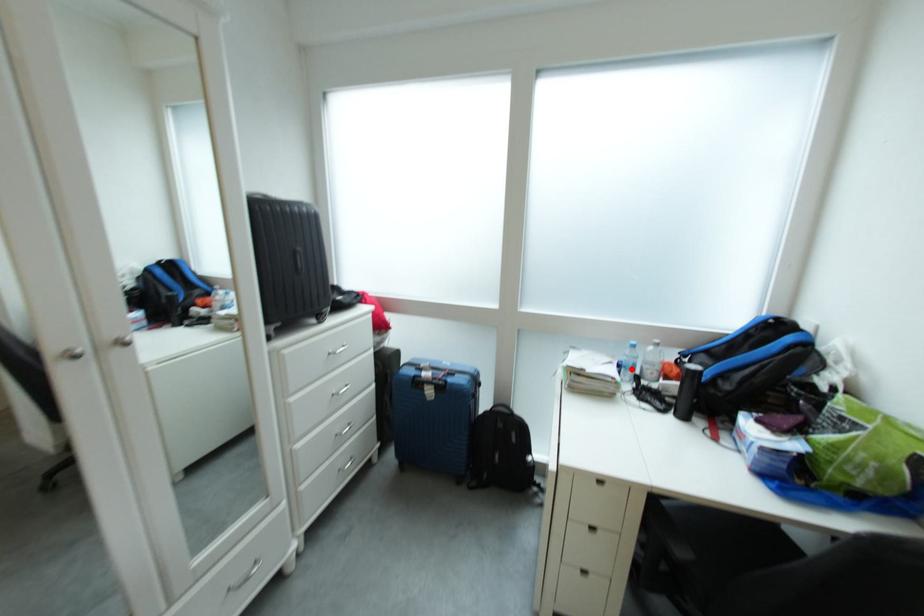
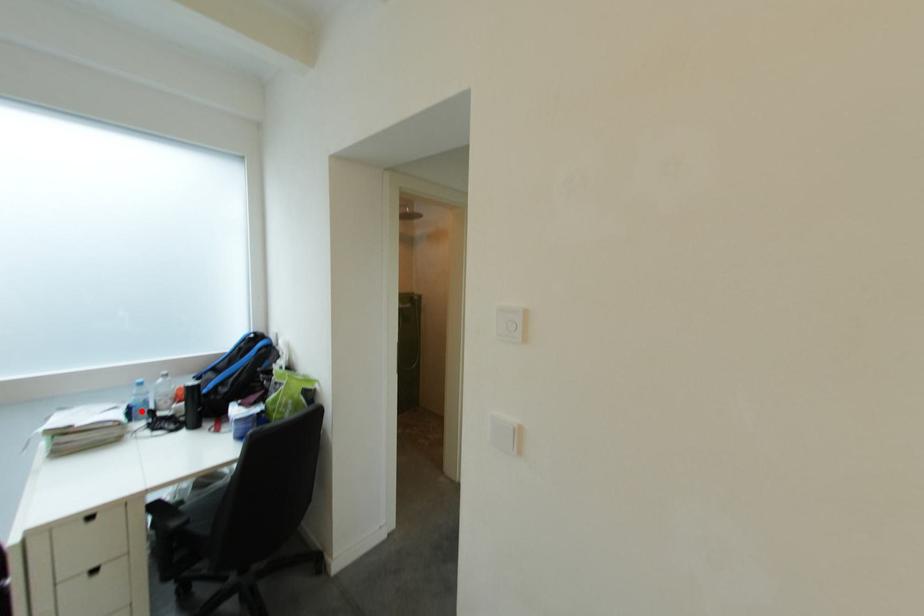
I am providing you with two images of the same scene from different viewpoints. A red point is marked on the first image and another point is marked on the second image. Are the points marked in image1 and image2 representing the same 3D position?

Yes